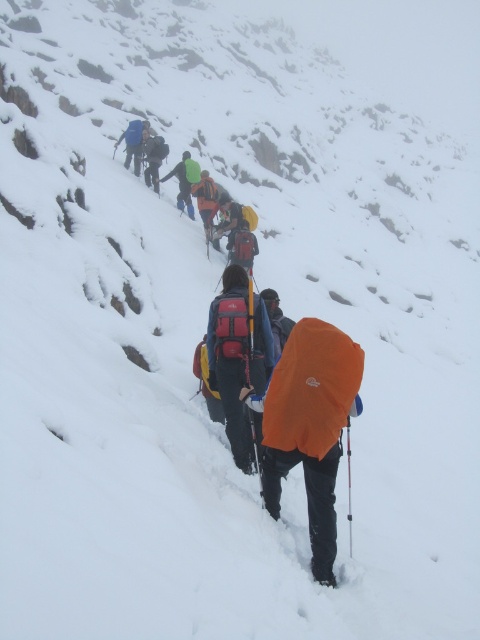
Question: Which of the following is the closest to the observer?

Choices:
 (A) orange fabric jacket at center
 (B) matte blue backpack at upper center

Answer: (A)

Question: Does orange fabric jacket at center have a larger size compared to dark blue jacket at upper center?

Choices:
 (A) no
 (B) yes

Answer: (B)

Question: Does orange fabric jacket at center have a lesser width compared to dark blue jacket at upper center?

Choices:
 (A) no
 (B) yes

Answer: (A)

Question: Is orange fabric jacket at center above matte blue backpack at upper center?

Choices:
 (A) no
 (B) yes

Answer: (A)

Question: Estimate the real-world distances between objects in this image. Which object is farther from the matte blue backpack at upper center?

Choices:
 (A) orange fabric backpack at center
 (B) dark blue jacket at upper center
 (C) orange fabric jacket at center
 (D) green fabric jacket at center

Answer: (C)

Question: Which object is farther from the camera taking this photo?

Choices:
 (A) orange fabric backpack at center
 (B) dark blue jacket at upper center

Answer: (B)